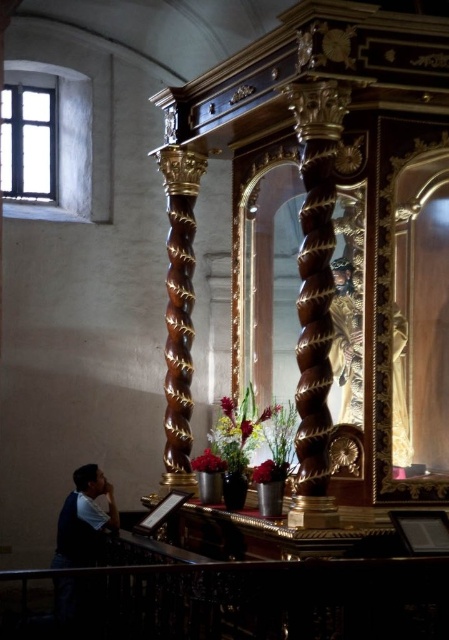
Question: Is glossy metal balustrade at lower center to the left of glossy wood column at center from the viewer's perspective?

Choices:
 (A) yes
 (B) no

Answer: (A)

Question: Which point is closer to the camera?

Choices:
 (A) glossy wood column at center
 (B) glossy metal balustrade at lower center

Answer: (B)

Question: Is glossy metal balustrade at lower center in front of glossy wood column at center?

Choices:
 (A) yes
 (B) no

Answer: (A)

Question: Where is glossy metal balustrade at lower center located in relation to glossy wood column at center in the image?

Choices:
 (A) right
 (B) left

Answer: (B)